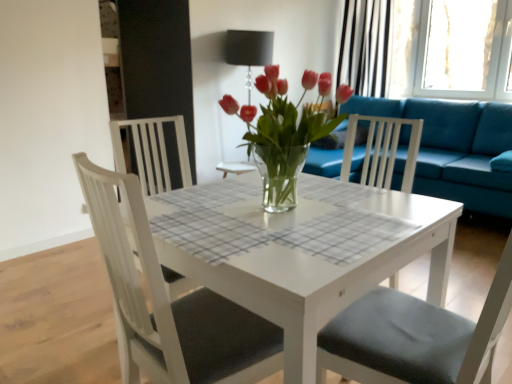
Locate an element on the screen. free spot above white glossy table at center (from a real-world perspective) is located at coordinates (283, 214).